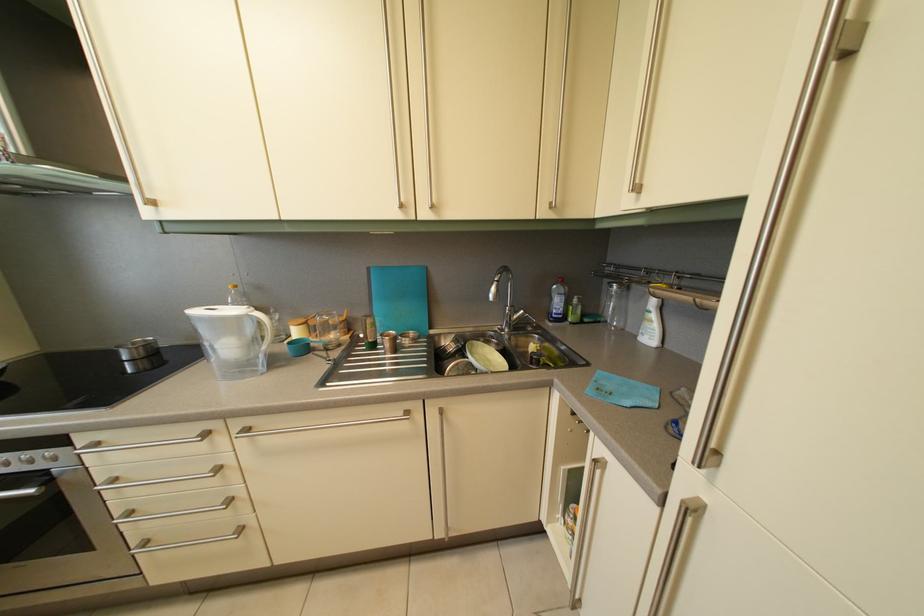
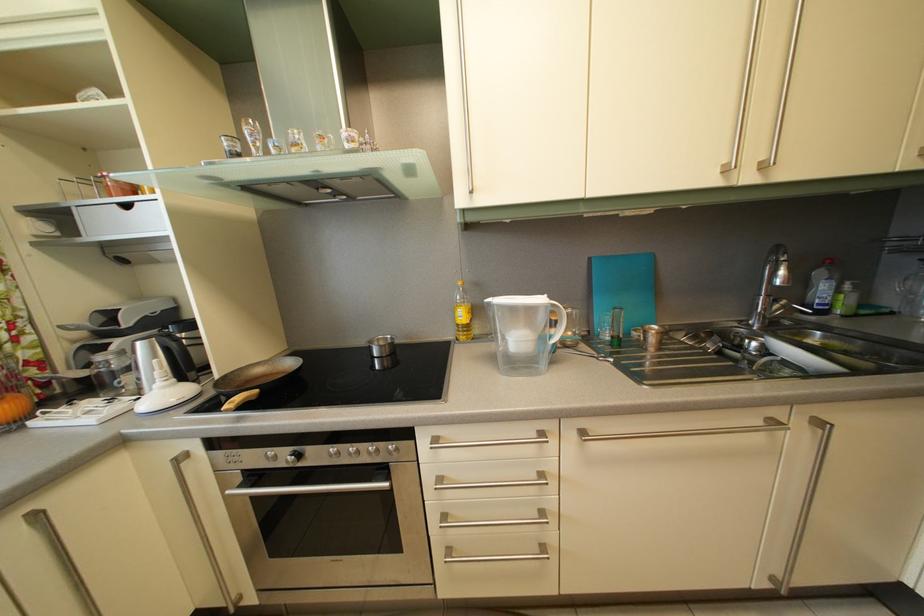
Question: Which direction would the cameraman need to move to produce the second image? Reply with the corresponding letter.

Choices:
 (A) Left
 (B) Right
 (C) Forward
 (D) Backward

Answer: (A)